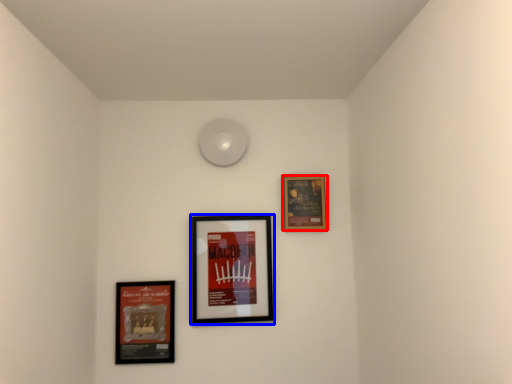
Question: Which object is closer to the camera taking this photo, picture frame (highlighted by a red box) or picture frame (highlighted by a blue box)?

Choices:
 (A) picture frame
 (B) picture frame

Answer: (B)